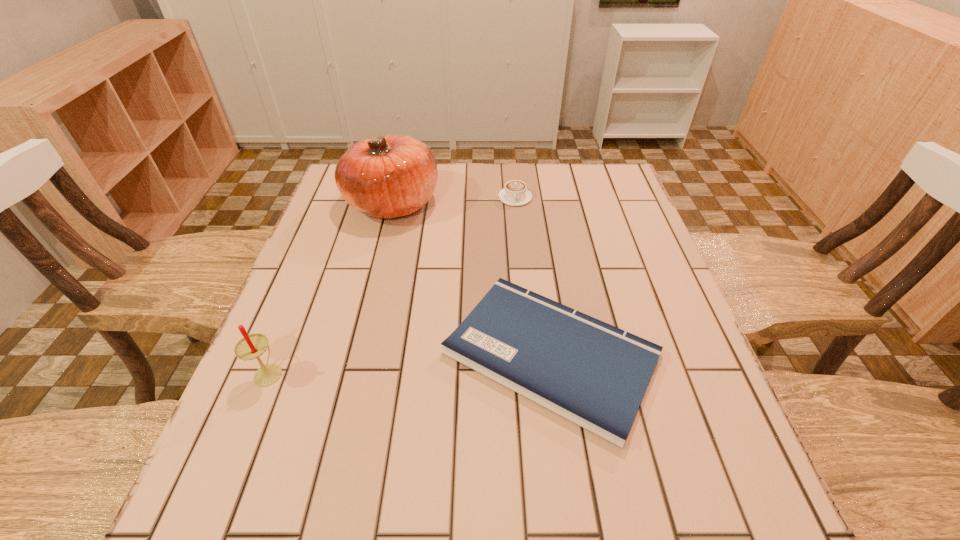
Locate an element on the screen. empty location between the pumpkin and the third tallest object is located at coordinates (453, 200).

I want to click on vacant area that lies between the shortest object and the candle, so click(x=410, y=363).

Where is `free spot between the paperback book and the candle`? The width and height of the screenshot is (960, 540). free spot between the paperback book and the candle is located at coordinates coord(410,363).

Find the location of a particular element. Image resolution: width=960 pixels, height=540 pixels. empty space that is in between the candle and the tallest object is located at coordinates (330, 287).

The image size is (960, 540). Find the location of `vacant space that is in between the pumpkin and the cappuccino`. vacant space that is in between the pumpkin and the cappuccino is located at coordinates (453, 200).

Identify the location of empty space between the paperback book and the candle. (410, 363).

The height and width of the screenshot is (540, 960). I want to click on vacant point located between the third tallest object and the shortest object, so click(533, 276).

Identify the location of free space between the candle and the pumpkin. (330, 287).

At what (x,y) coordinates should I click in order to perform the action: click on free space between the shortest object and the pumpkin. Please return your answer as a coordinate pair (x, y). This screenshot has height=540, width=960. Looking at the image, I should click on (471, 279).

Identify the location of object identified as the second closest to the third shortest object. This screenshot has width=960, height=540. (389, 176).